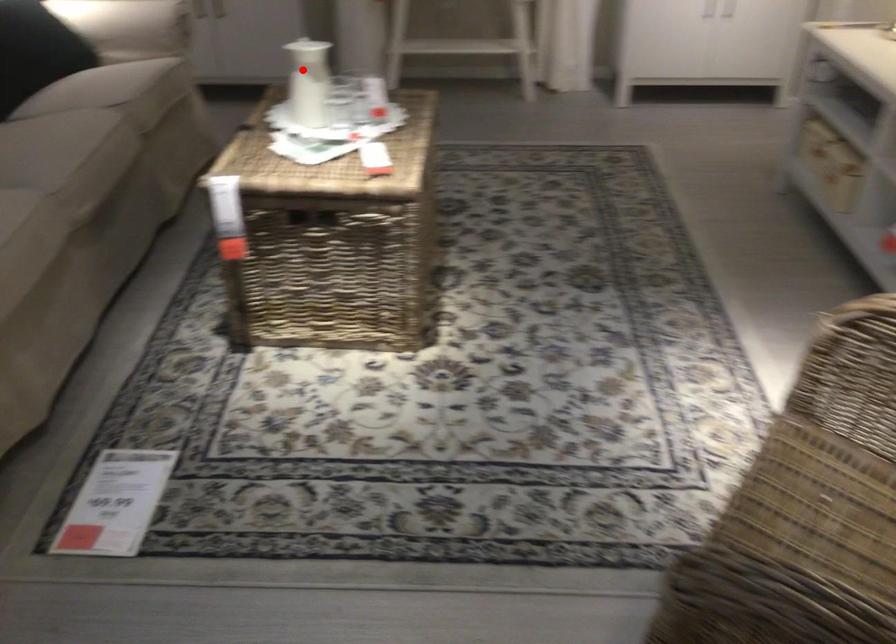
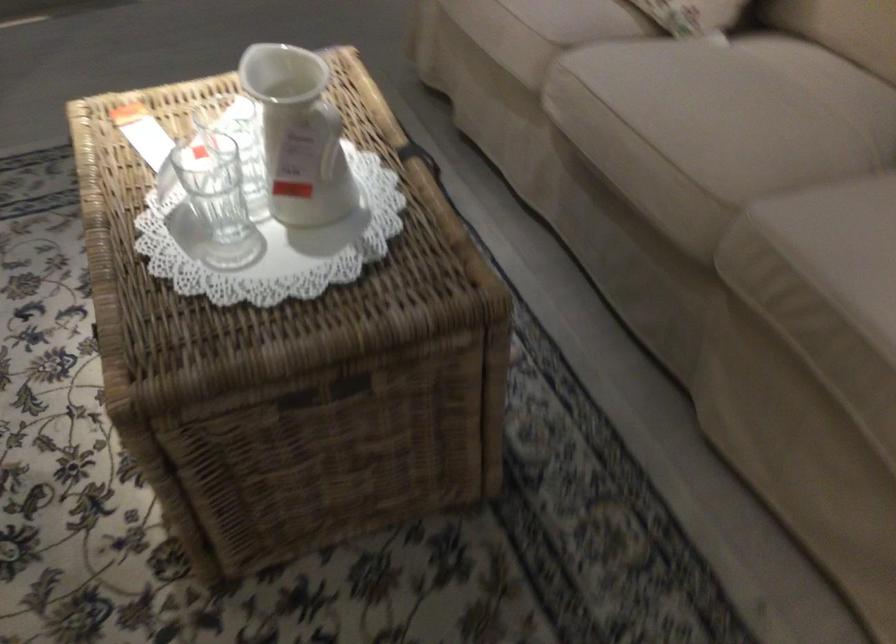
Question: A red point is marked in image1. In image2, is the corresponding 3D point closer to the camera or farther? Reply with the corresponding letter.

Choices:
 (A) The corresponding 3D point is closer.
 (B) The corresponding 3D point is farther.

Answer: (A)